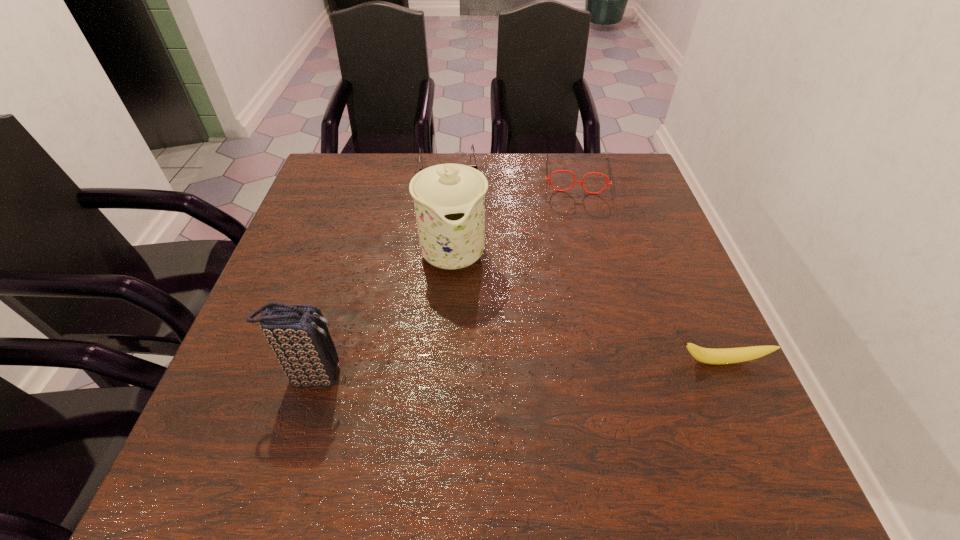
Find the location of a particular element. vacant spot on the desktop that is between the leftmost object and the banana and is positioned at the front lenses of the sunglasses is located at coordinates (469, 370).

I want to click on vacant space on the desktop that is between the second tallest object and the banana and is positioned on the spout of the tallest object, so pyautogui.click(x=477, y=370).

Where is `free space on the desktop that is between the second tallest object and the banana and is positioned on the front-facing side of the spectacles`? The width and height of the screenshot is (960, 540). free space on the desktop that is between the second tallest object and the banana and is positioned on the front-facing side of the spectacles is located at coordinates (579, 366).